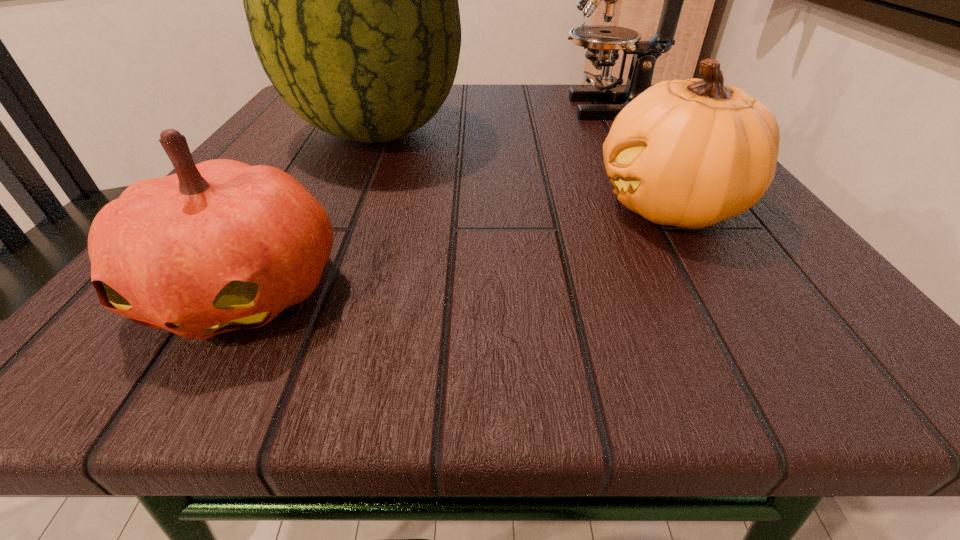
The height and width of the screenshot is (540, 960). Identify the location of vacant space located 0.300m on the front face of the right pumpkin. (372, 207).

Where is `microscope located in the far edge section of the desktop`? Image resolution: width=960 pixels, height=540 pixels. microscope located in the far edge section of the desktop is located at coordinates (603, 42).

The image size is (960, 540). Find the location of `watermelon that is at the far edge`. watermelon that is at the far edge is located at coordinates (351, 0).

Where is `object at the near edge`? object at the near edge is located at coordinates (218, 246).

The height and width of the screenshot is (540, 960). What are the coordinates of `watermelon that is at the left edge` in the screenshot? It's located at (351, 0).

The width and height of the screenshot is (960, 540). I want to click on pumpkin that is positioned at the left edge, so click(x=218, y=246).

You are a GUI agent. You are given a task and a screenshot of the screen. Output one action in this format:
    pyautogui.click(x=<x>, y=<y>)
    Task: Click on the microscope at the right edge
    This screenshot has height=540, width=960.
    Given the screenshot: What is the action you would take?
    pyautogui.click(x=603, y=42)

Locate an element on the screen. The image size is (960, 540). pumpkin at the right edge is located at coordinates (690, 153).

This screenshot has width=960, height=540. In order to click on object that is at the far left corner in this screenshot , I will do `click(351, 0)`.

In order to click on object at the near left corner in this screenshot , I will do (x=218, y=246).